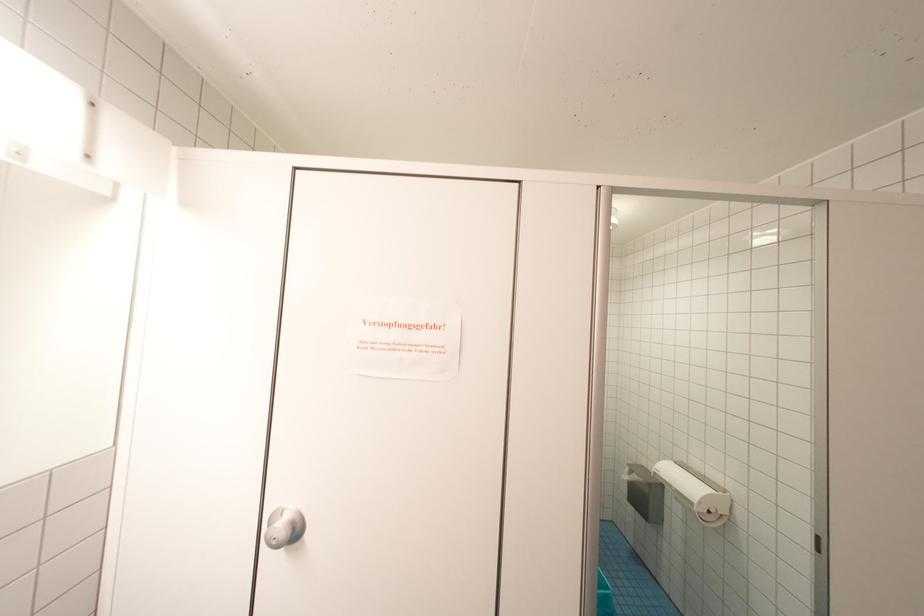
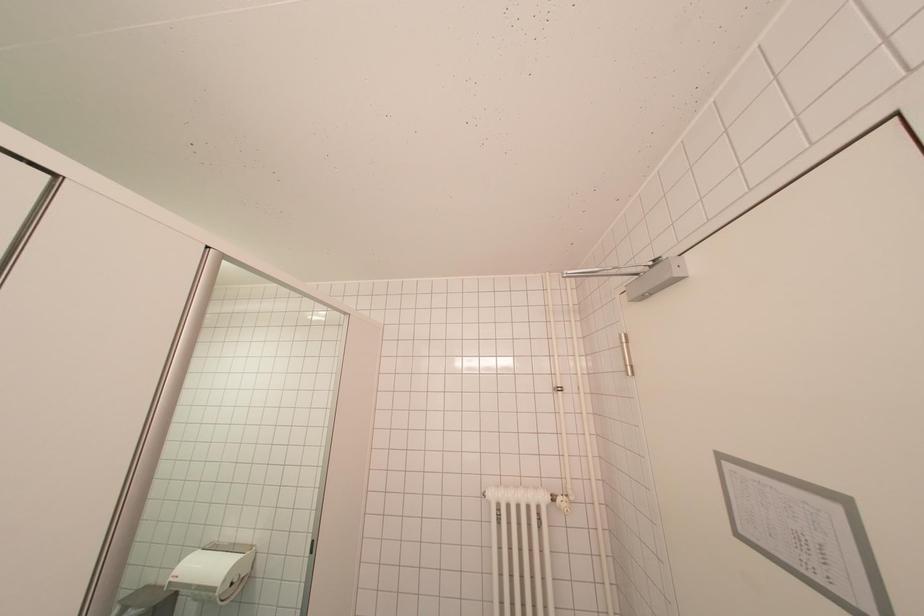
Question: The first image is from the beginning of the video and the second image is from the end. How did the camera likely rotate when shooting the video?

Choices:
 (A) Left
 (B) Right
 (C) Up
 (D) Down

Answer: (B)